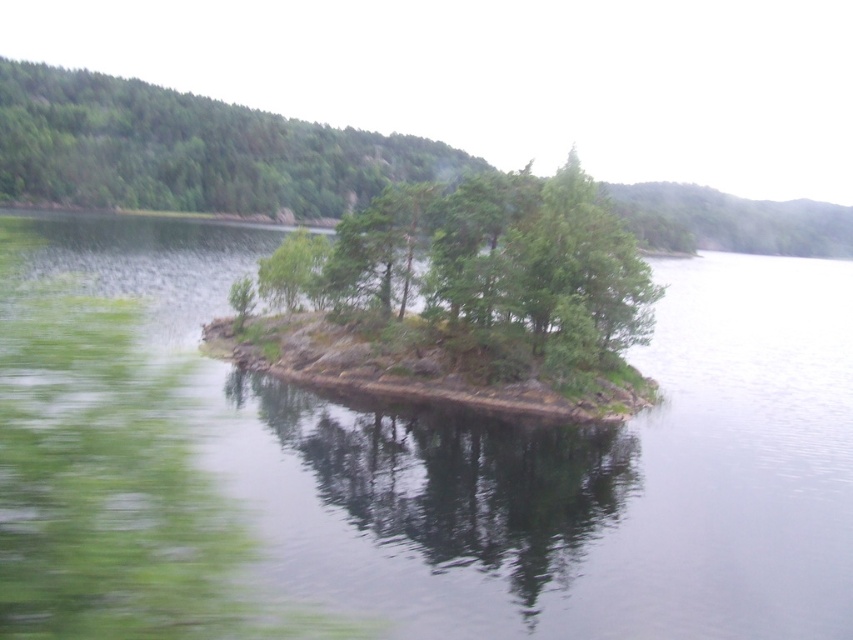
Question: Among these points, which one is nearest to the camera?

Choices:
 (A) (195, 164)
 (B) (482, 337)

Answer: (B)

Question: Among these points, which one is farthest from the camera?

Choices:
 (A) (570, 445)
 (B) (57, 189)
 (C) (556, 179)
 (D) (323, 246)

Answer: (B)

Question: Observing the image, what is the correct spatial positioning of greenish water at center in reference to green leafy trees at center?

Choices:
 (A) below
 (B) above

Answer: (B)

Question: Estimate the real-world distances between objects in this image. Which object is farther from the green matte tree at upper left?

Choices:
 (A) green leafy trees at center
 (B) greenish water at center
 (C) green leafy tree at center

Answer: (C)

Question: Is green matte tree at upper left to the right of green leafy tree at center from the viewer's perspective?

Choices:
 (A) no
 (B) yes

Answer: (A)

Question: Does greenish water at center appear under green leafy trees at center?

Choices:
 (A) no
 (B) yes

Answer: (A)